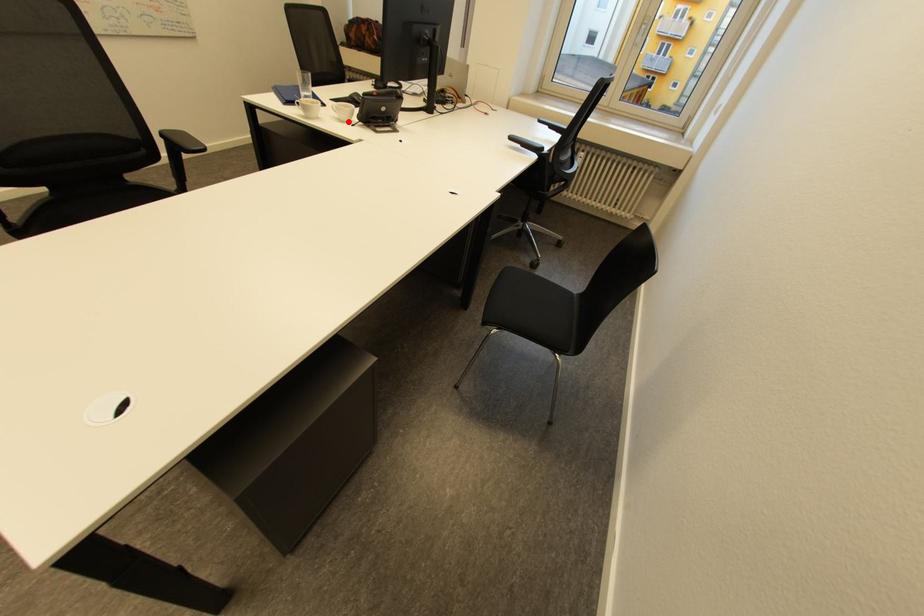
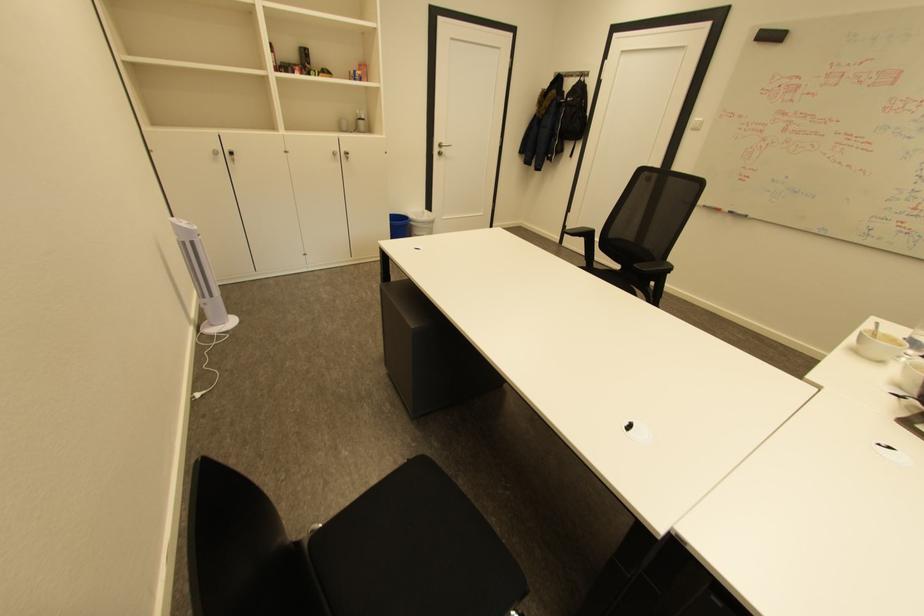
Where in the second image is the point corresponding to the highlighted location from the first image?

(906, 386)